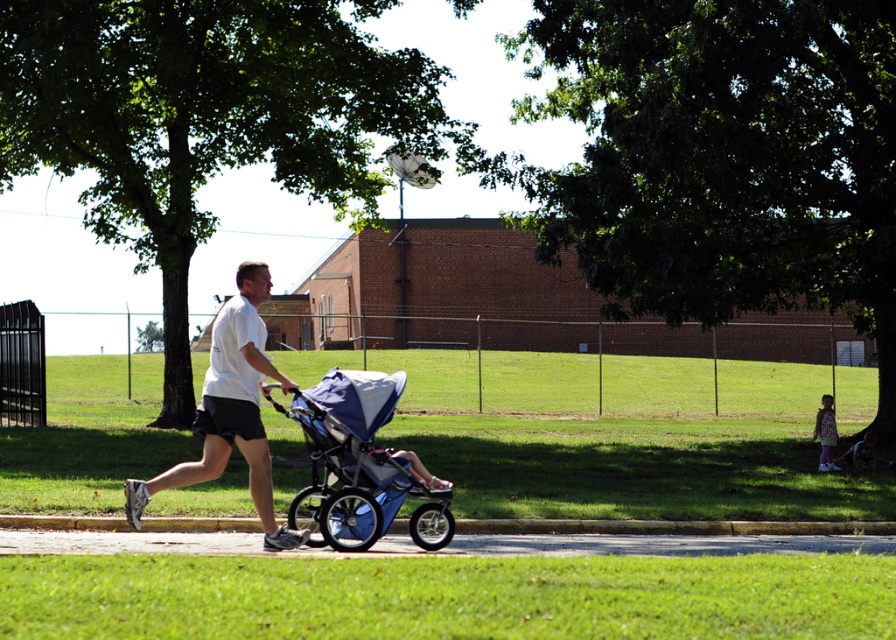
Is point (261, 371) closer to viewer compared to point (392, 456)?

Yes, it is in front of point (392, 456).

Who is lower down, white matte shirt at center or light blue fabric stroller at center?

light blue fabric stroller at center

What do you see at coordinates (230, 410) in the screenshot?
I see `white matte shirt at center` at bounding box center [230, 410].

The height and width of the screenshot is (640, 896). I want to click on white matte shirt at center, so click(230, 410).

Does blue fabric stroller at center have a larger size compared to light blue fabric stroller at center?

Indeed, blue fabric stroller at center has a larger size compared to light blue fabric stroller at center.

Who is more forward, (349,513) or (407,470)?

Point (349,513) is in front.

The width and height of the screenshot is (896, 640). Describe the element at coordinates (358, 465) in the screenshot. I see `blue fabric stroller at center` at that location.

Where is `blue fabric stroller at center`? This screenshot has height=640, width=896. blue fabric stroller at center is located at coordinates (358, 465).

Is point (237, 436) more distant than point (819, 419)?

No, (237, 436) is closer to viewer.

Between white matte shirt at center and pastel pink dress at lower right, which one appears on the right side from the viewer's perspective?

pastel pink dress at lower right

Between point (231, 381) and point (834, 435), which one is positioned behind?

Point (834, 435)

The image size is (896, 640). In order to click on white matte shirt at center in this screenshot , I will do `click(230, 410)`.